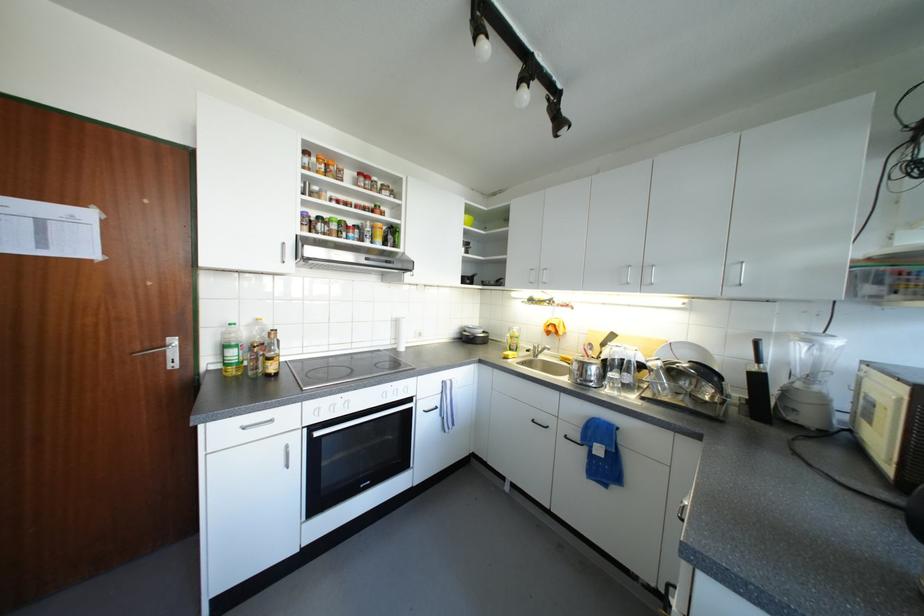
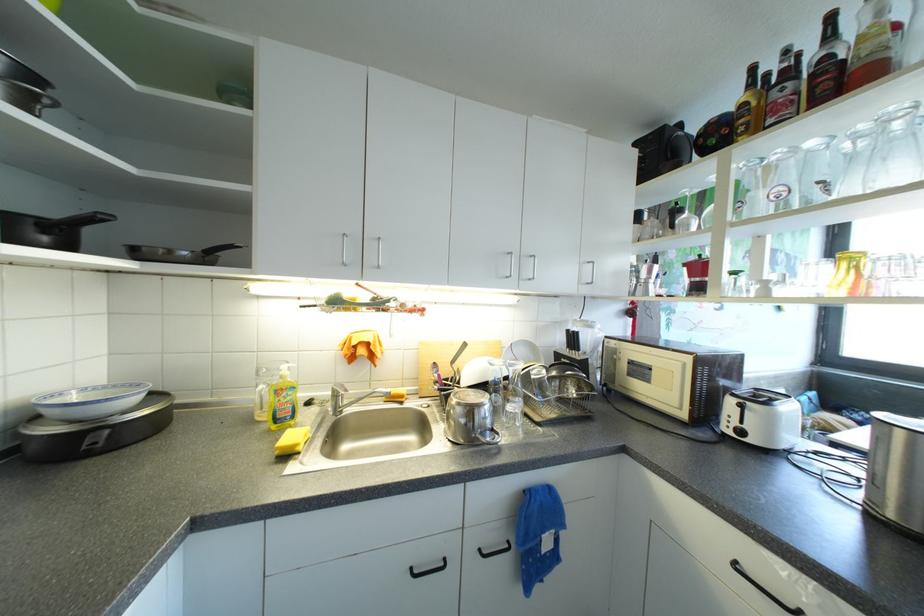
Find the pixel in the second image that matches (x=520, y=331) in the first image.

(290, 373)